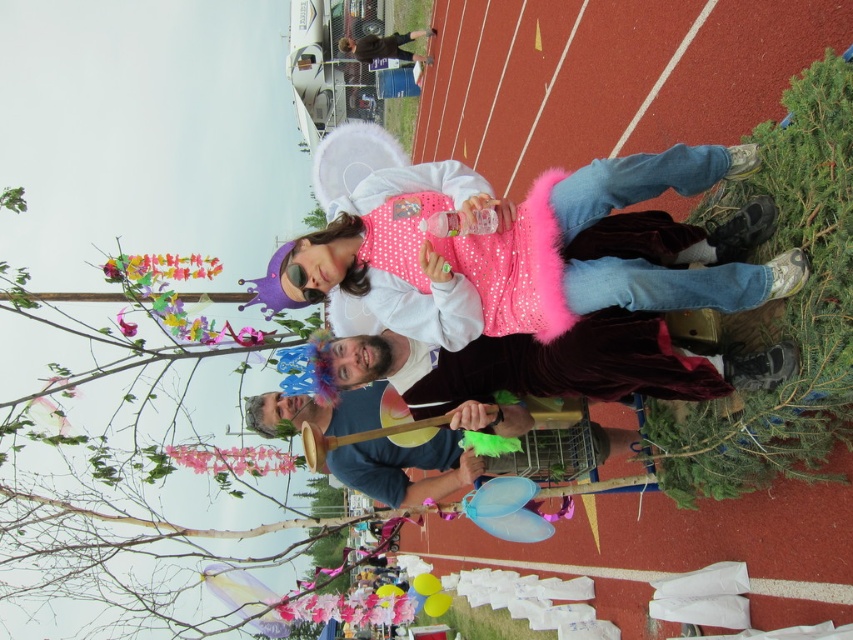
Does pink paper tree at upper center come in front of pink fluffy tutu at center?

That is False.

Who is shorter, pink paper tree at upper center or pink fluffy tutu at center?

With less height is pink fluffy tutu at center.

Is point (140, 608) positioned after point (647, 268)?

That is True.

This screenshot has height=640, width=853. I want to click on pink paper tree at upper center, so click(x=122, y=486).

Between pink paper tree at upper center and velvet maroon cape at center, which one appears on the right side from the viewer's perspective?

velvet maroon cape at center is more to the right.

Does pink paper tree at upper center have a smaller size compared to velvet maroon cape at center?

No, pink paper tree at upper center is not smaller than velvet maroon cape at center.

Is point (225, 620) positioned behind point (608, 333)?

Yes, it is.

Image resolution: width=853 pixels, height=640 pixels. I want to click on pink paper tree at upper center, so click(x=122, y=486).

What do you see at coordinates (122, 486) in the screenshot? The height and width of the screenshot is (640, 853). I see `pink paper tree at upper center` at bounding box center [122, 486].

Does pink paper tree at upper center have a greater height compared to green leafy tree at lower right?

Yes.

Does point (131, 608) come behind point (708, 419)?

Yes, it is.

Identify the location of pink paper tree at upper center. The image size is (853, 640). (122, 486).